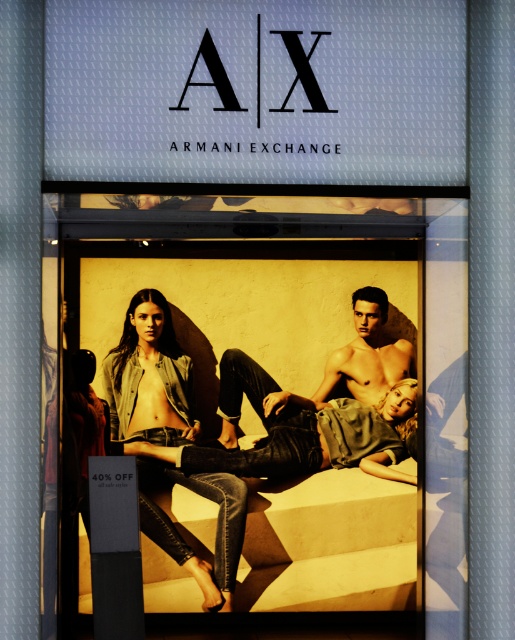
In the scene shown: Who is positioned more to the right, denim jeans at center or denim jacket at center?

denim jeans at center is more to the right.

From the picture: Is denim jeans at center smaller than denim jacket at center?

Answer: Incorrect, denim jeans at center is not smaller in size than denim jacket at center.

I want to click on denim jeans at center, so click(283, 312).

Image resolution: width=515 pixels, height=640 pixels. Identify the location of denim jeans at center. (283, 312).